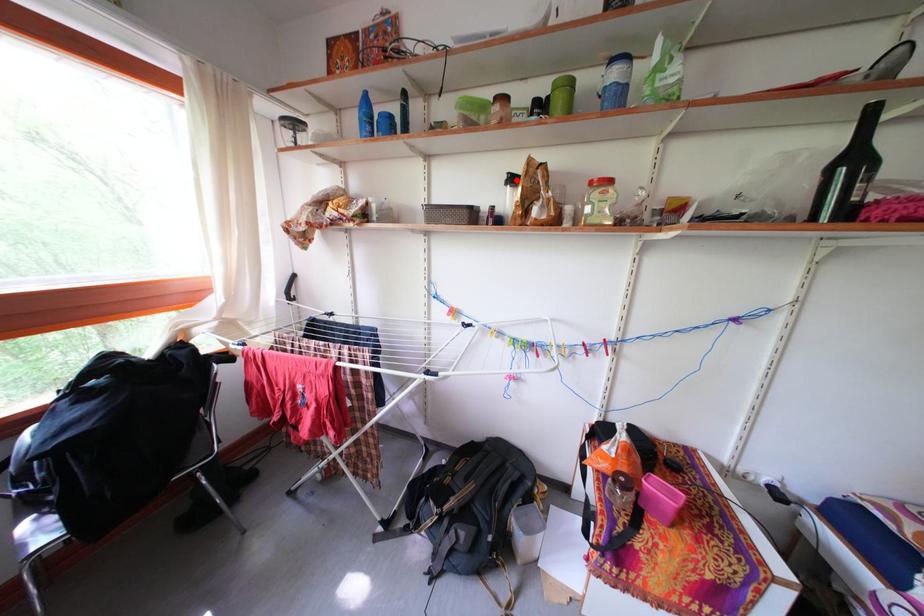
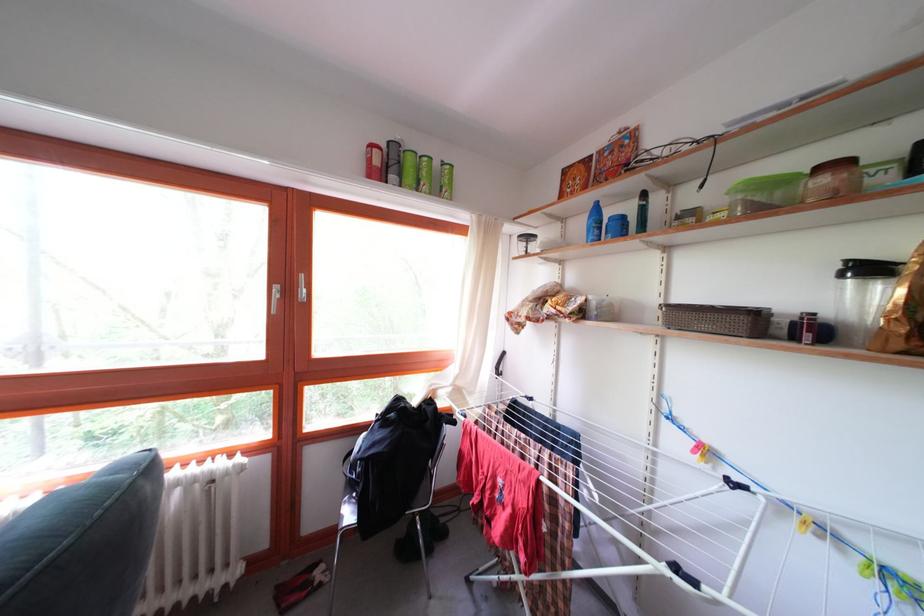
Locate, in the second image, the point that corresponds to the highlighted location in the first image.

(855, 267)